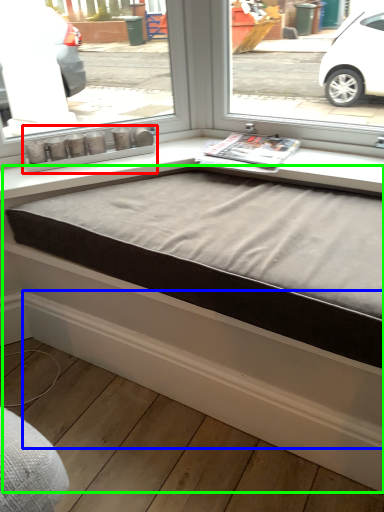
Question: Which object is the farthest from window box (highlighted by a red box)? Choose among these: curb (highlighted by a blue box) or bed frame (highlighted by a green box).

Choices:
 (A) curb
 (B) bed frame

Answer: (A)